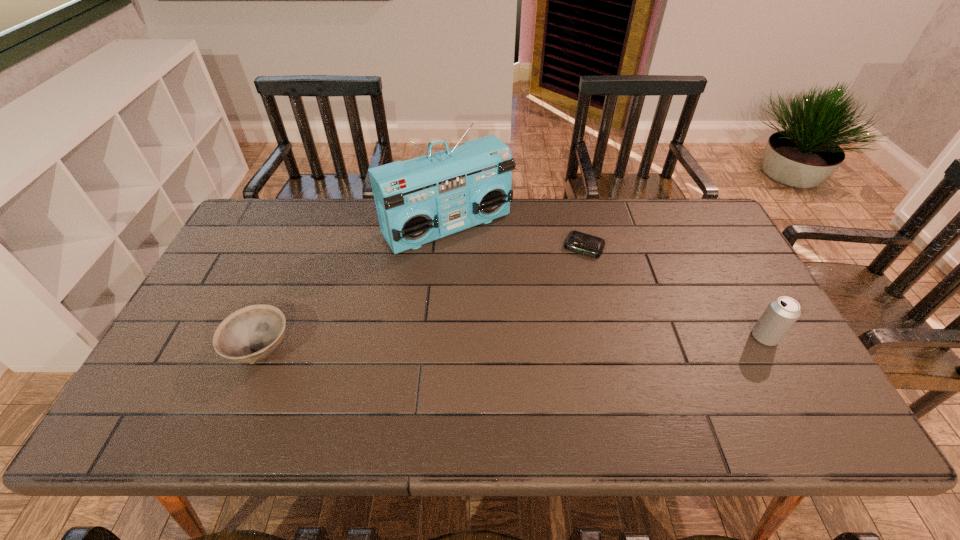
The width and height of the screenshot is (960, 540). In order to click on bowl in this screenshot , I will do (251, 334).

I want to click on the leftmost object, so click(251, 334).

Locate an element on the screen. the third shortest object is located at coordinates (780, 315).

At what (x,y) coordinates should I click in order to perform the action: click on beer can. Please return your answer as a coordinate pair (x, y). The image size is (960, 540). Looking at the image, I should click on (780, 315).

Where is `the shortest object`? The width and height of the screenshot is (960, 540). the shortest object is located at coordinates (578, 242).

Locate an element on the screen. the third object from left to right is located at coordinates (578, 242).

This screenshot has height=540, width=960. Identify the location of the third object from right to left. (423, 199).

The height and width of the screenshot is (540, 960). In order to click on the tallest object in this screenshot , I will do `click(423, 199)`.

The width and height of the screenshot is (960, 540). What are the coordinates of `free region located on the back of the leftmost object` in the screenshot? It's located at point(281,300).

Identify the location of free space located 0.190m on the left of the rightmost object. (678, 337).